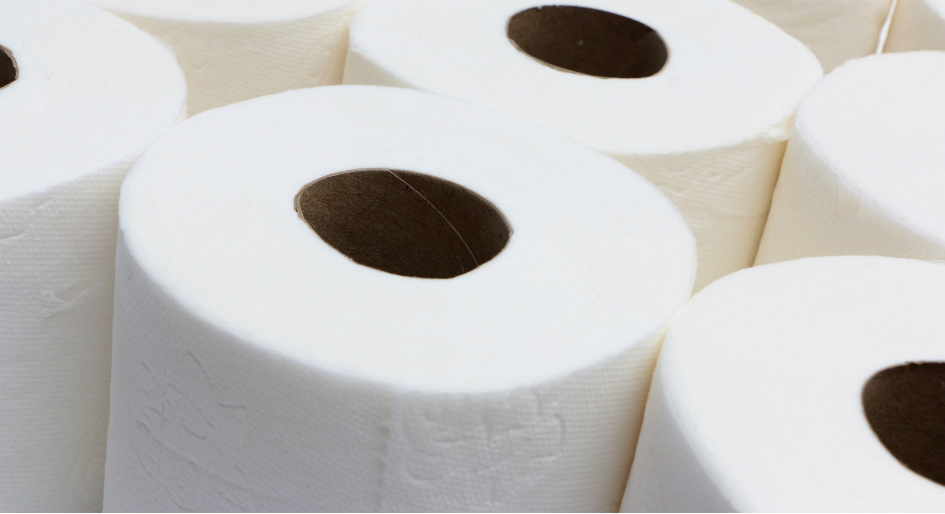
Identify the location of cardboard roll. (6, 67), (396, 206), (593, 44), (901, 393).